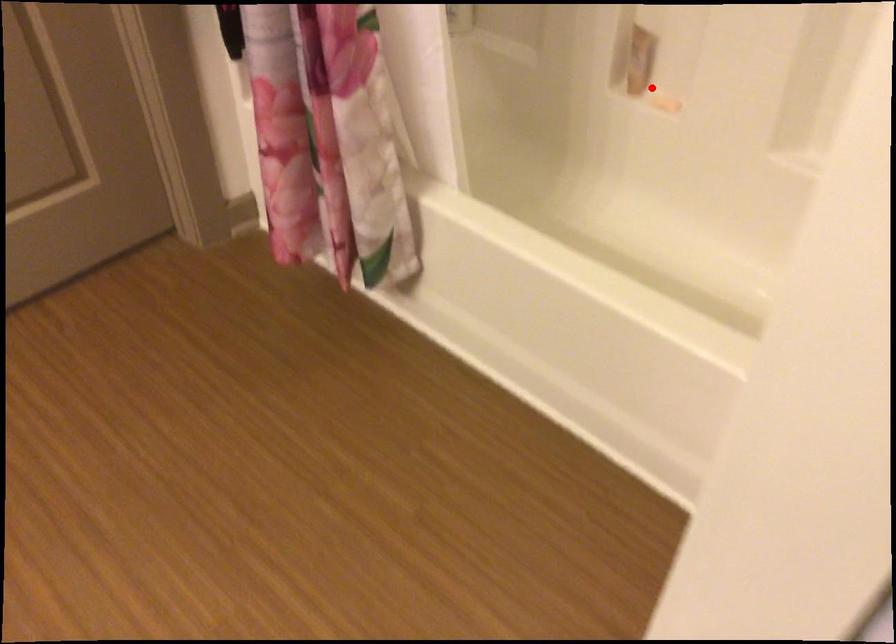
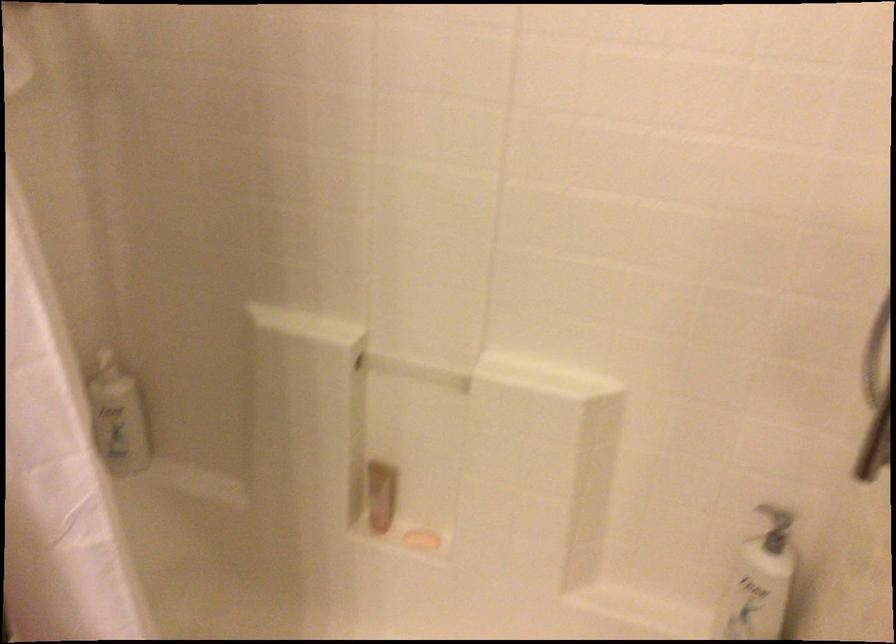
The point at the highlighted location is marked in the first image. Where is the corresponding point in the second image?

(421, 540)